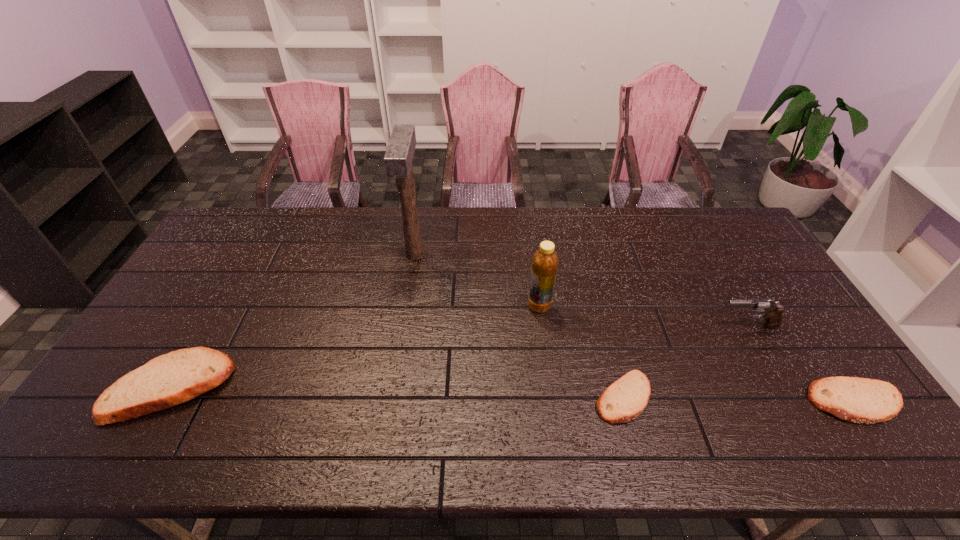
I want to click on the leftmost object, so click(x=174, y=378).

You are a GUI agent. You are given a task and a screenshot of the screen. Output one action in this format:
    pyautogui.click(x=<x>, y=<y>)
    Task: Click on the tallest pita bread
    This screenshot has height=540, width=960.
    Given the screenshot: What is the action you would take?
    pyautogui.click(x=174, y=378)

You are a GUI agent. You are given a task and a screenshot of the screen. Output one action in this format:
    pyautogui.click(x=<x>, y=<y>)
    Task: Click on the fourth object from left to right
    
    Given the screenshot: What is the action you would take?
    pyautogui.click(x=624, y=400)

Where is `the shortest pita bread`? This screenshot has width=960, height=540. the shortest pita bread is located at coordinates (624, 400).

Locate an element on the screen. The width and height of the screenshot is (960, 540). the second tallest pita bread is located at coordinates (858, 400).

I want to click on the rightmost pita bread, so click(858, 400).

Where is `the second object from left to right`? The image size is (960, 540). the second object from left to right is located at coordinates (398, 158).

This screenshot has width=960, height=540. Identify the location of the tallest object. (398, 158).

Image resolution: width=960 pixels, height=540 pixels. What are the coordinates of `the third tallest object` in the screenshot? It's located at (771, 312).

Locate an element on the screen. The image size is (960, 540). the fourth nearest object is located at coordinates (771, 312).